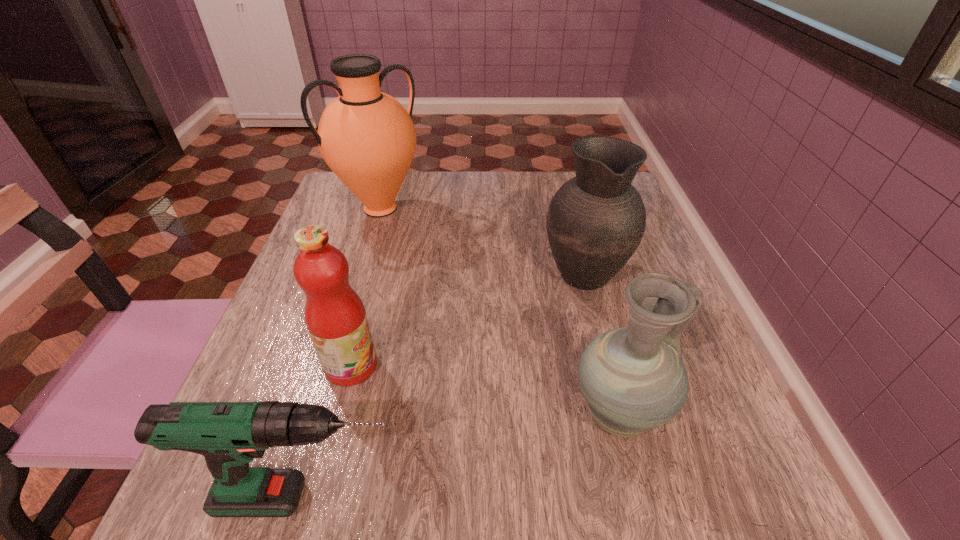
Where is `object present at the near left corner`? Image resolution: width=960 pixels, height=540 pixels. object present at the near left corner is located at coordinates (229, 435).

The width and height of the screenshot is (960, 540). I want to click on vacant region at the far edge of the desktop, so click(x=447, y=209).

Identify the location of vacant space at the left edge. This screenshot has height=540, width=960. (303, 341).

Identify the location of vacant position at the right edge of the desktop. (725, 409).

Where is `vacant space at the far left corner of the desktop`? vacant space at the far left corner of the desktop is located at coordinates (334, 194).

Where is `free space between the fourth nearest object and the drill`? The image size is (960, 540). free space between the fourth nearest object and the drill is located at coordinates (446, 385).

This screenshot has height=540, width=960. I want to click on vacant space that's between the fruit juice and the leftmost pitcher, so click(366, 287).

This screenshot has width=960, height=540. Identify the location of free space between the leftmost pitcher and the fruit juice. (366, 287).

This screenshot has height=540, width=960. Find the location of `vacant area that lies between the second farthest object and the farthest pitcher`. vacant area that lies between the second farthest object and the farthest pitcher is located at coordinates (482, 240).

You are a GUI agent. You are given a task and a screenshot of the screen. Output one action in this format:
    pyautogui.click(x=<x>, y=<y>)
    Task: Click on the unoccupied area between the second farthest pitcher and the fruit juice
    The height and width of the screenshot is (540, 960).
    Given the screenshot: What is the action you would take?
    pyautogui.click(x=468, y=319)